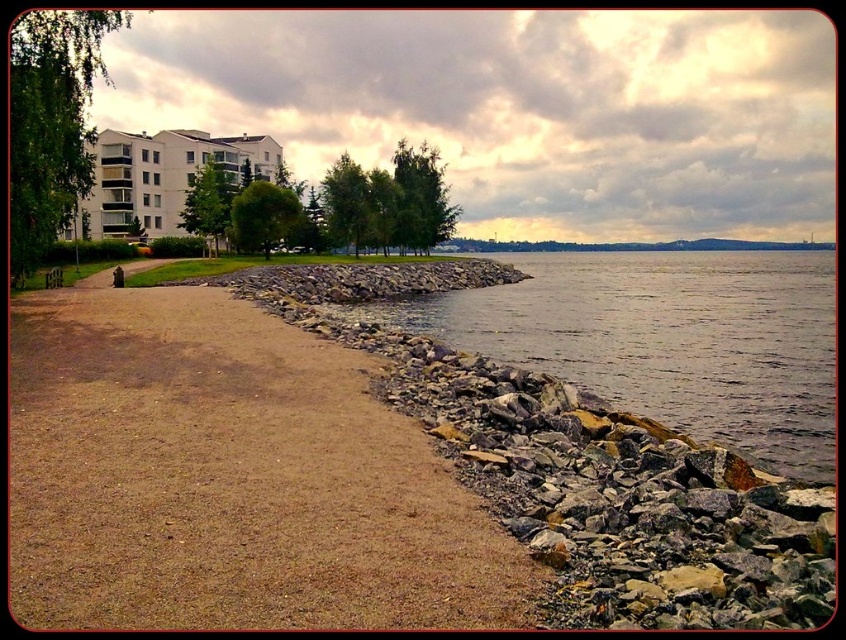
Question: Among these points, which one is farthest from the camera?

Choices:
 (A) (349, 403)
 (B) (575, 365)

Answer: (B)

Question: Which point is farther from the camera taking this photo?

Choices:
 (A) (812, 262)
 (B) (332, 502)

Answer: (A)

Question: From the image, what is the correct spatial relationship of brown gravel path at lower left in relation to grayish water at lower right?

Choices:
 (A) above
 (B) below

Answer: (B)

Question: Is brown gravel path at lower left to the left of grayish water at lower right from the viewer's perspective?

Choices:
 (A) yes
 (B) no

Answer: (A)

Question: Among these objects, which one is nearest to the camera?

Choices:
 (A) grayish water at lower right
 (B) brown gravel path at lower left

Answer: (B)

Question: Does brown gravel path at lower left have a lesser width compared to grayish water at lower right?

Choices:
 (A) no
 (B) yes

Answer: (B)